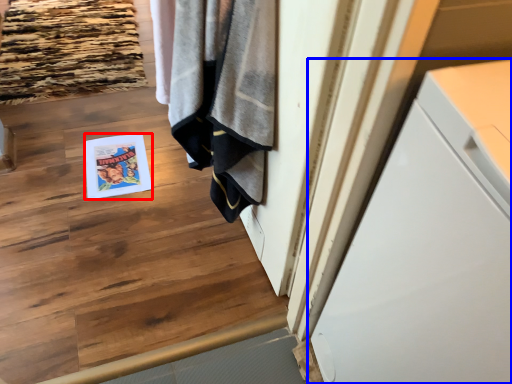
Question: Which point is closer to the camera, magazine (highlighted by a red box) or cabinetry (highlighted by a blue box)?

Choices:
 (A) magazine
 (B) cabinetry

Answer: (B)